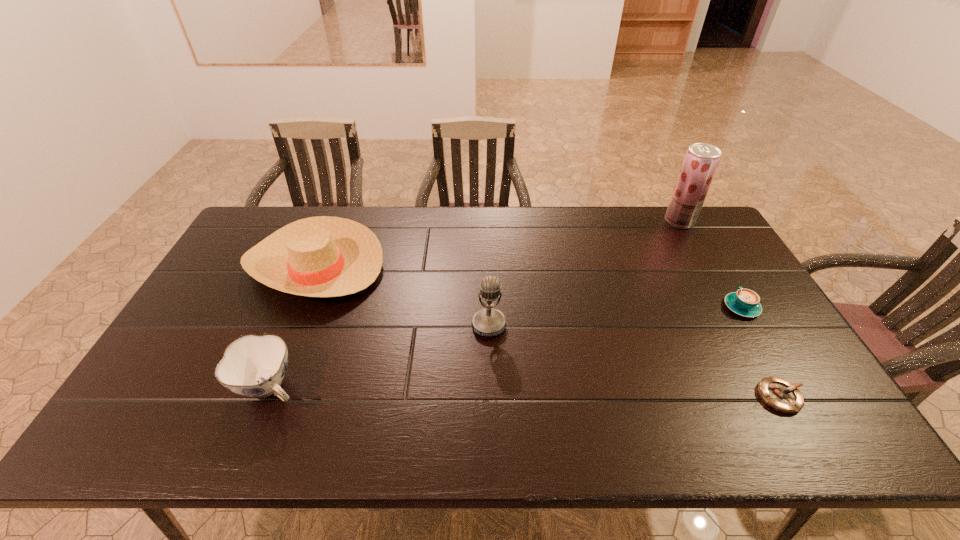
Locate an element on the screen. This screenshot has width=960, height=540. fruit juice located in the right edge section of the desktop is located at coordinates (701, 161).

Where is `cappuccino situated at the right edge`? cappuccino situated at the right edge is located at coordinates (744, 302).

Where is `ashtray that is at the right edge`? The height and width of the screenshot is (540, 960). ashtray that is at the right edge is located at coordinates (779, 394).

Locate an element on the screen. This screenshot has height=540, width=960. object located at the far left corner is located at coordinates (324, 256).

The height and width of the screenshot is (540, 960). Identify the location of object present at the far right corner. (701, 161).

Where is `object at the near right corner`? This screenshot has width=960, height=540. object at the near right corner is located at coordinates (779, 394).

This screenshot has height=540, width=960. I want to click on free location at the far edge of the desktop, so click(x=439, y=224).

The image size is (960, 540). Find the location of `vacant space at the near edge`. vacant space at the near edge is located at coordinates [x=502, y=445].

Where is `vacant space at the right edge of the desktop`? The height and width of the screenshot is (540, 960). vacant space at the right edge of the desktop is located at coordinates (695, 275).

This screenshot has height=540, width=960. Identify the location of vacant space at the near left corner. (145, 449).